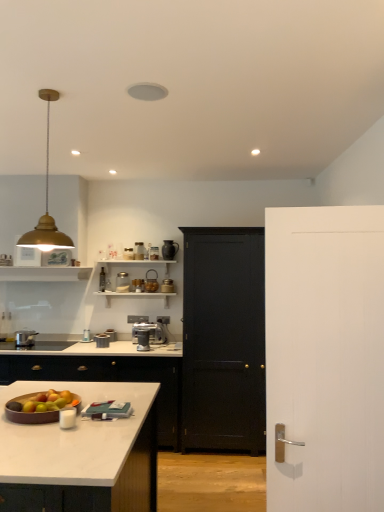
Question: Is point (96, 338) closer or farther from the camera than point (170, 283)?

Choices:
 (A) farther
 (B) closer

Answer: (B)

Question: Based on their sizes in the image, would you say metallic silver canister at center, which is the 2th appliance in left-to-right order, is bigger or smaller than metallic silver canister at upper center, the 7th appliance when ordered from left to right?

Choices:
 (A) small
 (B) big

Answer: (B)

Question: Estimate the real-world distances between objects in this image. Which object is closer to the white marble countertop at center?

Choices:
 (A) metallic silver toaster at upper center, arranged as the first appliance when viewed from the left
 (B) green matte apple at lower left
 (C) gold metallic pendant light at upper left
 (D) metallic silver toaster at center, the 5th appliance viewed from the left
 (E) clear glass jar at upper center, marked as the 4th appliance in a left-to-right arrangement

Answer: (B)

Question: Estimate the real-world distances between objects in this image. Which object is farther from the white marble countertop at center?

Choices:
 (A) green matte apple at lower left
 (B) metallic silver toaster at center, arranged as the 3th appliance when viewed from the left
 (C) satin silver coffee machine at center
 (D) metallic silver toaster at center, the 4th appliance viewed from the right
 (E) metallic silver canister at upper center, the 7th appliance when ordered from left to right

Answer: (D)